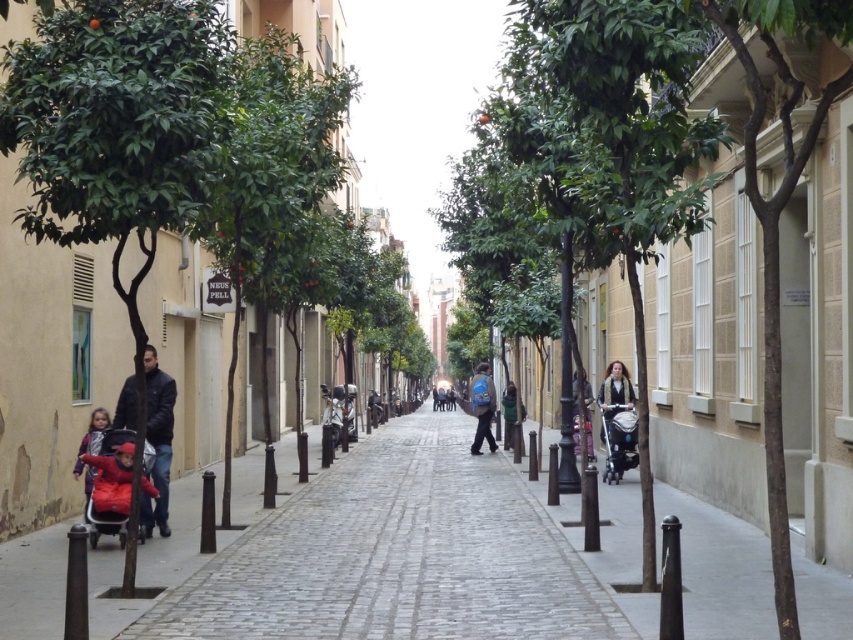
Question: Among these objects, which one is nearest to the camera?

Choices:
 (A) matte red jacket at lower left
 (B) red fabric baby carriage at lower left
 (C) dark blue jacket at left

Answer: (B)

Question: Among these objects, which one is nearest to the camera?

Choices:
 (A) matte black coat at center
 (B) light brown leather jacket at center
 (C) cobblestone sidewalk at center
 (D) black plastic baby carriage at right

Answer: (C)

Question: Is green leafy tree at center positioned behind cobblestone sidewalk at center?

Choices:
 (A) yes
 (B) no

Answer: (B)

Question: Can you confirm if red fabric baby carriage at lower left is positioned above blue backpack at center?

Choices:
 (A) no
 (B) yes

Answer: (B)

Question: Is black plastic baby carriage at right to the left of blue backpack at center from the viewer's perspective?

Choices:
 (A) no
 (B) yes

Answer: (A)

Question: Which object is the closest to the black plastic baby carriage at right?

Choices:
 (A) cobblestone sidewalk at center
 (B) light brown leather jacket at center
 (C) matte blue backpack at center
 (D) green leafy tree at center

Answer: (A)